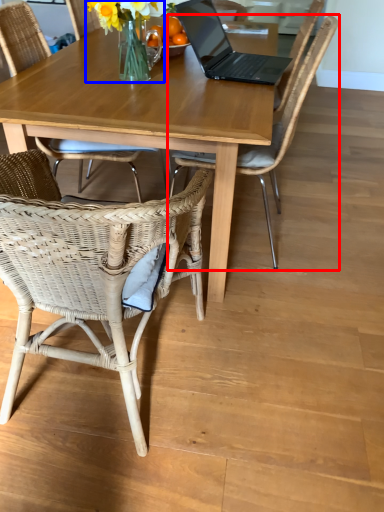
Question: Among these objects, which one is nearest to the camera, chair (highlighted by a red box) or floral arrangement (highlighted by a blue box)?

Choices:
 (A) chair
 (B) floral arrangement

Answer: (A)